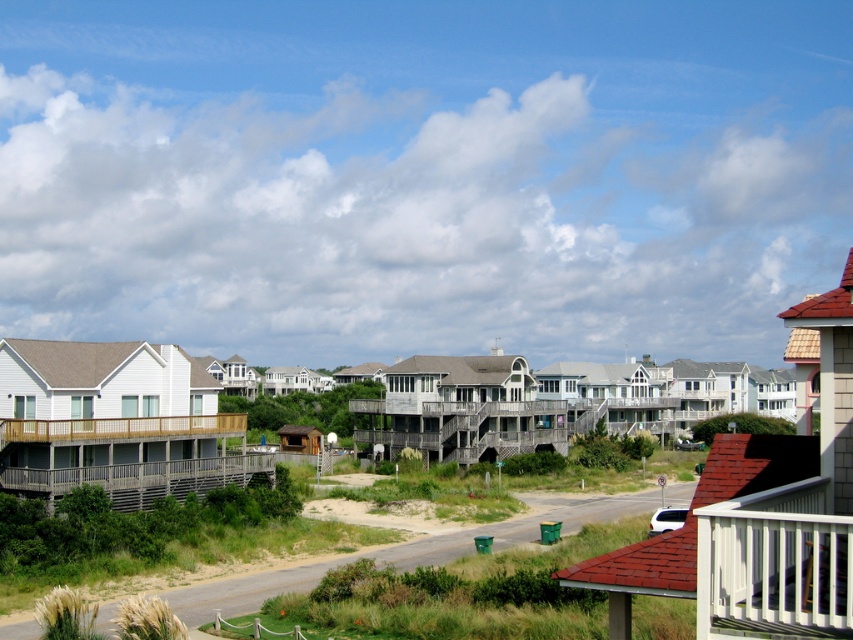
You are standing at the center of the paved road in the coastal residential area. You want to reach the wooden deck at left. Which direction should you walk to get there?

Since the wooden deck at left is located at position coordinates point (128, 456), you should walk towards the left side of the image to reach it.

You are standing at the point marked as point (x=201, y=609) in the image. You want to walk straight ahead for 50 meters. Will you exit the scene depicted in the image?

The distance between point (x=201, y=609) and the viewer is 40.38 meters. Since you plan to walk 50 meters straight ahead, which is longer than the distance to the scene edge, you will exit the scene.

You are a delivery person approaching the wooden deck at left and the green sand at lower left. Which object will you encounter first?

The wooden deck at left is closer to you than the green sand at lower left, so you will encounter the wooden deck at left first.